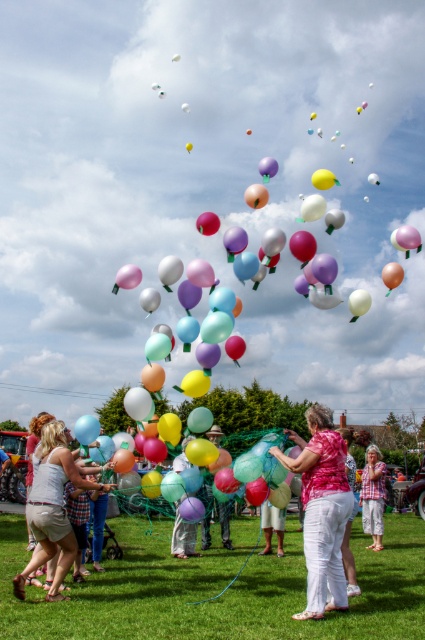
You are a photographer standing in the grassy field. You want to take a photo of the matte white shorts at lower left and the pink cotton shirt at center. Which object should you focus on first if you want to capture both in the same frame without moving the camera?

The matte white shorts at lower left is above the pink cotton shirt at center, so you should focus on the pink cotton shirt at center first to ensure both are in focus since it is closer to the camera.

You are standing at the center of the image and want to locate the matte white shorts at lower left. In which direction should you look to find them?

The matte white shorts at lower left are located at point (53,506), so you should look to the lower left direction from the center of the image to find them.

You are organizing a balloon release event and need to ensure that the participants are dressed appropriately. Given the scene described, which participant is wearing clothing with a larger size between the matte white shorts at lower left and the pink cotton shirt at center?

The matte white shorts at lower left has a larger size compared to the pink cotton shirt at center.